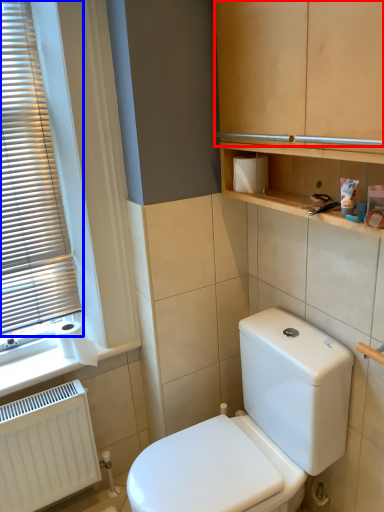
Question: Which point is further to the camera, cabinetry (highlighted by a red box) or window blind (highlighted by a blue box)?

Choices:
 (A) cabinetry
 (B) window blind

Answer: (B)